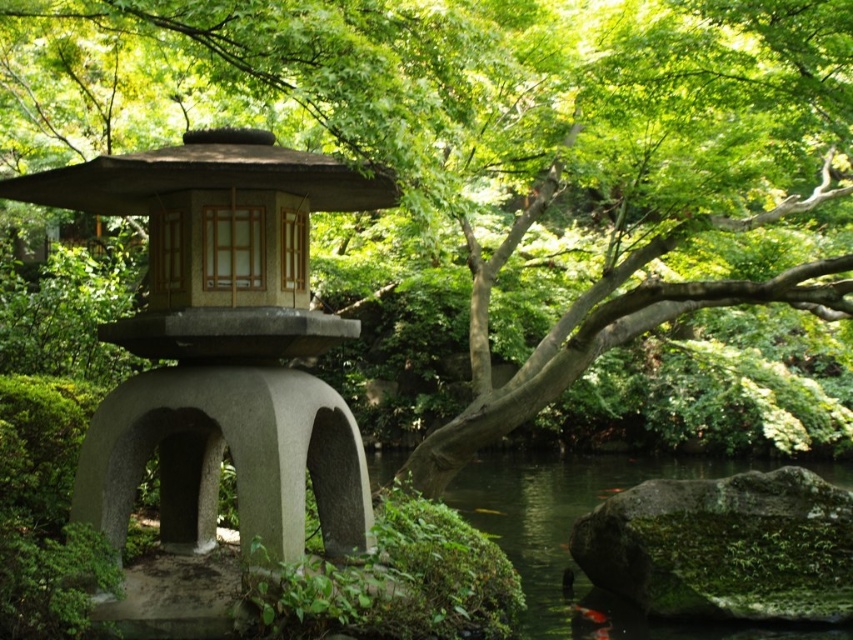
Question: Which is nearer to the green mossy rock at lower right?

Choices:
 (A) matte stone lantern at center
 (B) green mossy water at lower center

Answer: (B)

Question: Does green mossy rock at lower right come behind green mossy water at lower center?

Choices:
 (A) no
 (B) yes

Answer: (B)

Question: Which of the following is the closest to the observer?

Choices:
 (A) matte stone lantern at center
 (B) green mossy rock at lower right

Answer: (A)

Question: Considering the relative positions of matte stone lantern at center and green mossy rock at lower right in the image provided, where is matte stone lantern at center located with respect to green mossy rock at lower right?

Choices:
 (A) below
 (B) above

Answer: (B)

Question: Which point is closer to the camera taking this photo?

Choices:
 (A) (532, 492)
 (B) (653, 536)

Answer: (B)

Question: Does matte stone lantern at center have a larger size compared to green mossy rock at lower right?

Choices:
 (A) yes
 (B) no

Answer: (A)